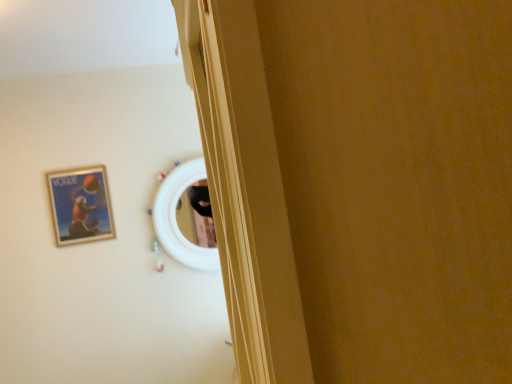
Question: Is white glossy mirror at center spatially inside wooden glossy picture frame at upper left, or outside of it?

Choices:
 (A) inside
 (B) outside

Answer: (B)

Question: From a real-world perspective, is white glossy mirror at center physically located above or below wooden glossy picture frame at upper left?

Choices:
 (A) above
 (B) below

Answer: (B)

Question: From the image's perspective, is white glossy mirror at center located above or below wooden glossy picture frame at upper left?

Choices:
 (A) above
 (B) below

Answer: (B)

Question: Based on their sizes in the image, would you say wooden glossy picture frame at upper left is bigger or smaller than white glossy mirror at center?

Choices:
 (A) big
 (B) small

Answer: (B)

Question: Relative to white glossy mirror at center, is wooden glossy picture frame at upper left in front or behind?

Choices:
 (A) behind
 (B) front

Answer: (B)

Question: Is wooden glossy picture frame at upper left spatially inside white glossy mirror at center, or outside of it?

Choices:
 (A) outside
 (B) inside

Answer: (A)

Question: Is point (101, 195) closer or farther from the camera than point (167, 213)?

Choices:
 (A) farther
 (B) closer

Answer: (B)